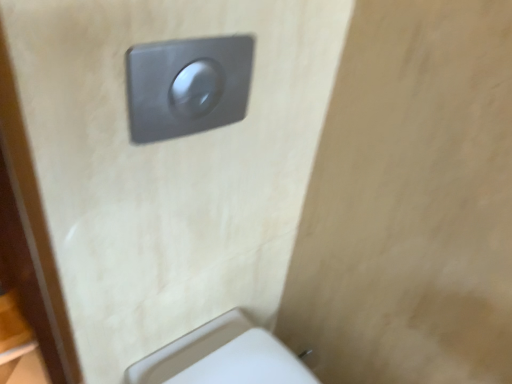
The width and height of the screenshot is (512, 384). Describe the element at coordinates (162, 167) in the screenshot. I see `metallic gray flush button at upper center` at that location.

What do you see at coordinates (187, 85) in the screenshot?
I see `satin silver switch at upper center` at bounding box center [187, 85].

Where is `white plastic toilet at lower right`? This screenshot has width=512, height=384. white plastic toilet at lower right is located at coordinates (222, 357).

From a real-world perspective, which object stands above the other?

satin silver switch at upper center is physically above.

In terms of height, does satin silver switch at upper center look taller or shorter compared to white plastic toilet at lower right?

In the image, satin silver switch at upper center appears to be shorter than white plastic toilet at lower right.

Is satin silver switch at upper center behind metallic gray flush button at upper center?

Yes, the depth of satin silver switch at upper center is greater than that of metallic gray flush button at upper center.

Does point (215, 41) come farther from viewer compared to point (138, 34)?

Yes, it is behind point (138, 34).

Is metallic gray flush button at upper center located within satin silver switch at upper center?

No.

Is satin silver switch at upper center thinner than metallic gray flush button at upper center?

Yes.

From the image's perspective, is white plastic toilet at lower right on top of satin silver switch at upper center?

No.

Does point (181, 361) lie behind point (185, 132)?

Yes, point (181, 361) is farther from viewer.

Would you say white plastic toilet at lower right is a long distance from satin silver switch at upper center?

No, there isn't a large distance between white plastic toilet at lower right and satin silver switch at upper center.

From the image's perspective, is white plastic toilet at lower right above or below metallic gray flush button at upper center?

Based on their image positions, white plastic toilet at lower right is located beneath metallic gray flush button at upper center.

You are a GUI agent. You are given a task and a screenshot of the screen. Output one action in this format:
    pyautogui.click(x=<x>, y=<y>)
    Task: Click on the door located above the white plastic toilet at lower right (from the image's perspective)
    This screenshot has height=384, width=512.
    Given the screenshot: What is the action you would take?
    pyautogui.click(x=162, y=167)

Does white plastic toilet at lower right have a lesser width compared to metallic gray flush button at upper center?

In fact, white plastic toilet at lower right might be wider than metallic gray flush button at upper center.

Considering the positions of objects white plastic toilet at lower right and metallic gray flush button at upper center in the image provided, who is in front, white plastic toilet at lower right or metallic gray flush button at upper center?

metallic gray flush button at upper center is closer to the camera.

From the image's perspective, which is below, metallic gray flush button at upper center or satin silver switch at upper center?

metallic gray flush button at upper center.

Considering the positions of objects metallic gray flush button at upper center and satin silver switch at upper center in the image provided, who is more to the right, metallic gray flush button at upper center or satin silver switch at upper center?

From the viewer's perspective, satin silver switch at upper center appears more on the right side.

In the scene shown: Which point is more distant from viewer, (328, 38) or (239, 56)?

The point (328, 38) is farther from the camera.

Which of these two, metallic gray flush button at upper center or satin silver switch at upper center, is wider?

With larger width is metallic gray flush button at upper center.

From a real-world perspective, is metallic gray flush button at upper center over white plastic toilet at lower right?

Yes, from a real-world perspective, metallic gray flush button at upper center is above white plastic toilet at lower right.

Is white plastic toilet at lower right located within metallic gray flush button at upper center?

Definitely not — white plastic toilet at lower right is not inside metallic gray flush button at upper center.

Who is smaller, metallic gray flush button at upper center or white plastic toilet at lower right?

white plastic toilet at lower right is smaller.

Find the location of a particular element. The height and width of the screenshot is (384, 512). light switch located in front of the white plastic toilet at lower right is located at coordinates pos(187,85).

You are a GUI agent. You are given a task and a screenshot of the screen. Output one action in this format:
    pyautogui.click(x=<x>, y=<y>)
    Task: Click on the light switch that appears above the metallic gray flush button at upper center (from the image's perspective)
    Image resolution: width=512 pixels, height=384 pixels.
    Given the screenshot: What is the action you would take?
    pyautogui.click(x=187, y=85)

When comparing their distances from metallic gray flush button at upper center, does satin silver switch at upper center or white plastic toilet at lower right seem closer?

Based on the image, satin silver switch at upper center appears to be nearer to metallic gray flush button at upper center.

From the image, which object appears to be farther from white plastic toilet at lower right, satin silver switch at upper center or metallic gray flush button at upper center?

Among the two, satin silver switch at upper center is located further to white plastic toilet at lower right.

Based on their spatial positions, is metallic gray flush button at upper center or satin silver switch at upper center further from white plastic toilet at lower right?

satin silver switch at upper center lies further to white plastic toilet at lower right than the other object.

Which object lies nearer to the anchor point satin silver switch at upper center, metallic gray flush button at upper center or white plastic toilet at lower right?

metallic gray flush button at upper center is closer to satin silver switch at upper center.

From the image, which object appears to be farther from satin silver switch at upper center, white plastic toilet at lower right or metallic gray flush button at upper center?

white plastic toilet at lower right is further to satin silver switch at upper center.

Considering their positions, is white plastic toilet at lower right positioned closer to metallic gray flush button at upper center than satin silver switch at upper center?

Among the two, satin silver switch at upper center is located nearer to metallic gray flush button at upper center.

Where is `door between satin silver switch at upper center and white plastic toilet at lower right in the up-down direction`? This screenshot has width=512, height=384. door between satin silver switch at upper center and white plastic toilet at lower right in the up-down direction is located at coordinates (162, 167).